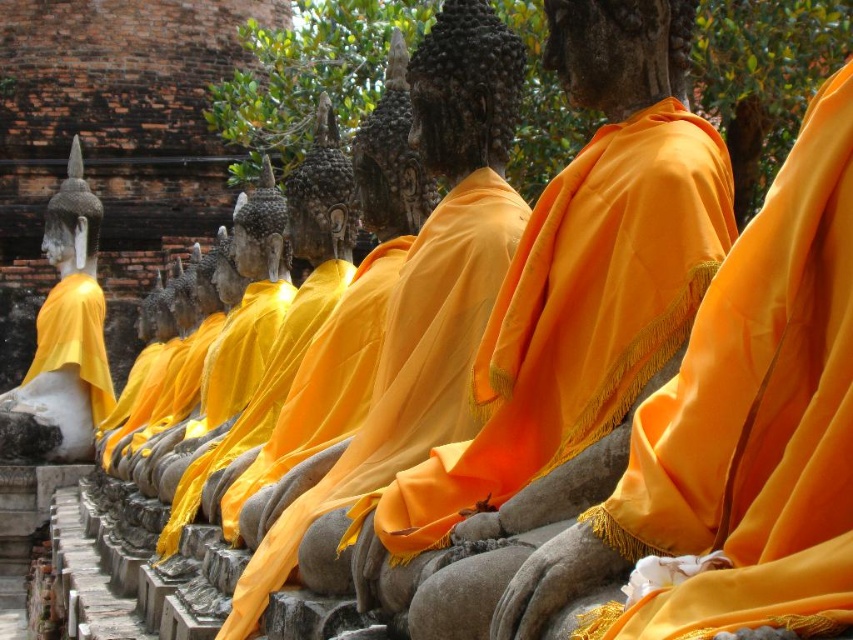
Question: Which of the following is the closest to the observer?

Choices:
 (A) (93, 260)
 (B) (447, 394)
 (C) (520, 326)

Answer: (C)

Question: Does orange silk cloth at center have a smaller size compared to matte yellow cloth at center?

Choices:
 (A) yes
 (B) no

Answer: (A)

Question: Can you confirm if orange silk cloth at center is thinner than matte gold statue at left?

Choices:
 (A) yes
 (B) no

Answer: (A)

Question: Estimate the real-world distances between objects in this image. Which object is closer to the orange silk cloth at center?

Choices:
 (A) matte yellow cloth at center
 (B) matte gold statue at left

Answer: (A)

Question: Based on their relative distances, which object is farther from the orange silk cloth at center?

Choices:
 (A) matte gold statue at left
 (B) matte yellow cloth at center

Answer: (A)

Question: Observing the image, what is the correct spatial positioning of matte yellow cloth at center in reference to matte gold statue at left?

Choices:
 (A) above
 (B) below

Answer: (B)